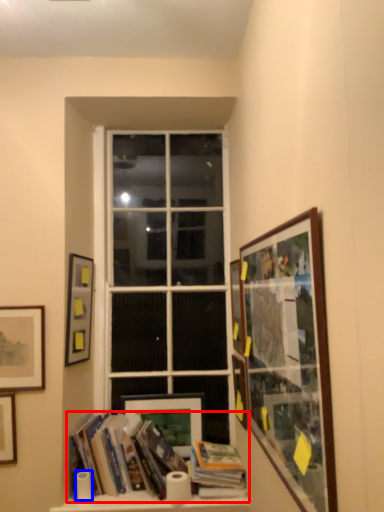
Question: Which object appears farthest to the camera in this image, book (highlighted by a red box) or toilet paper (highlighted by a blue box)?

Choices:
 (A) book
 (B) toilet paper

Answer: (B)